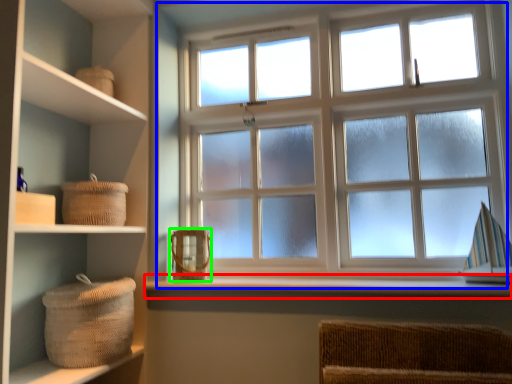
Question: Which object is positioned closest to window sill (highlighted by a red box)? Select from window (highlighted by a blue box) and basket (highlighted by a green box).

Choices:
 (A) window
 (B) basket

Answer: (B)